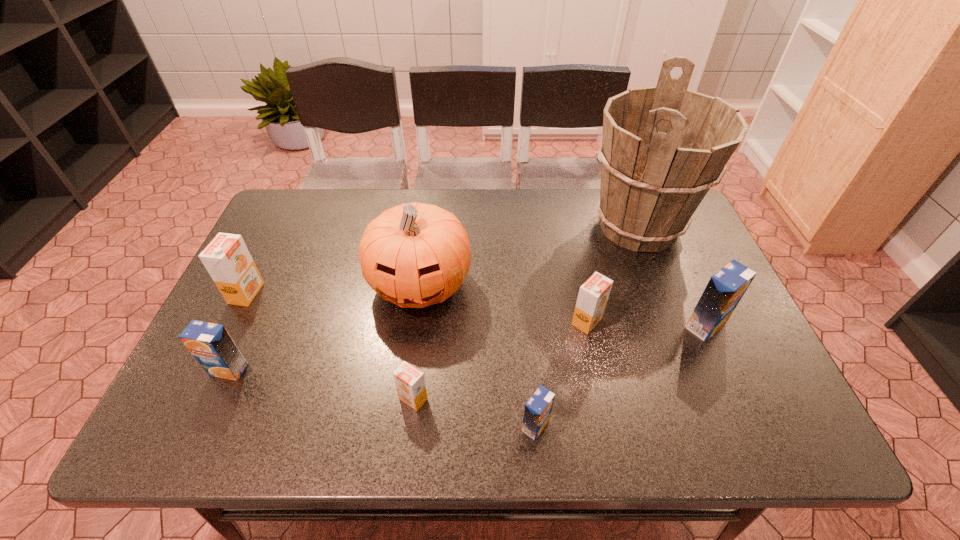
This screenshot has width=960, height=540. Identify the location of free area in between the smallest blue orange_juice and the third nearest orange_juice. click(382, 398).

Identify the location of the seventh closest object relative to the nearest orange orange juice. (726, 287).

I want to click on object that is the fourth closest to the tallest object, so click(x=537, y=412).

Identify the location of orange_juice that is the sixth closest to the seventh shortest object. The height and width of the screenshot is (540, 960). (726, 287).

Identify which orange_juice is located as the second nearest to the nearest orange_juice. Please provide its 2D coordinates. Your answer should be formatted as a tuple, i.e. [(x, y)], where the tuple contains the x and y coordinates of a point satisfying the conditions above.

[(593, 295)]

Locate an element on the screen. Image resolution: width=960 pixels, height=540 pixels. the second closest blue orange_juice relative to the smallest orange orange juice is located at coordinates (211, 345).

Locate which blue orange_juice ranks second in proximity to the rightmost blue orange_juice. Please provide its 2D coordinates. Your answer should be formatted as a tuple, i.e. [(x, y)], where the tuple contains the x and y coordinates of a point satisfying the conditions above.

[(211, 345)]

At what (x,y) coordinates should I click in order to perform the action: click on the second closest orange orange juice relative to the rightmost orange_juice. Please return your answer as a coordinate pair (x, y). The height and width of the screenshot is (540, 960). Looking at the image, I should click on (410, 383).

Identify the location of orange orange juice identified as the second closest to the tallest object. (410, 383).

This screenshot has height=540, width=960. I want to click on free space that satisfies the following two spatial constraints: 1. on the front side of the rightmost blue orange_juice; 2. on the left side of the second smallest orange orange juice, so click(588, 326).